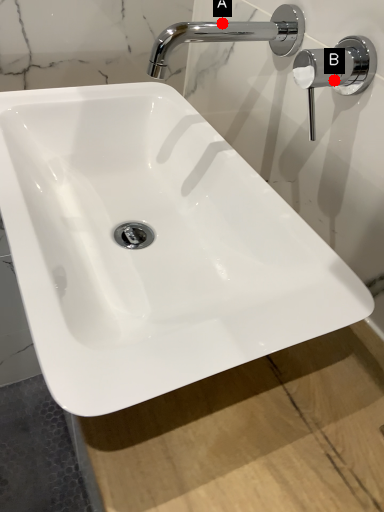
Question: Two points are circled on the image, labeled by A and B beside each circle. Which point is closer to the camera taking this photo?

Choices:
 (A) A is closer
 (B) B is closer

Answer: (B)